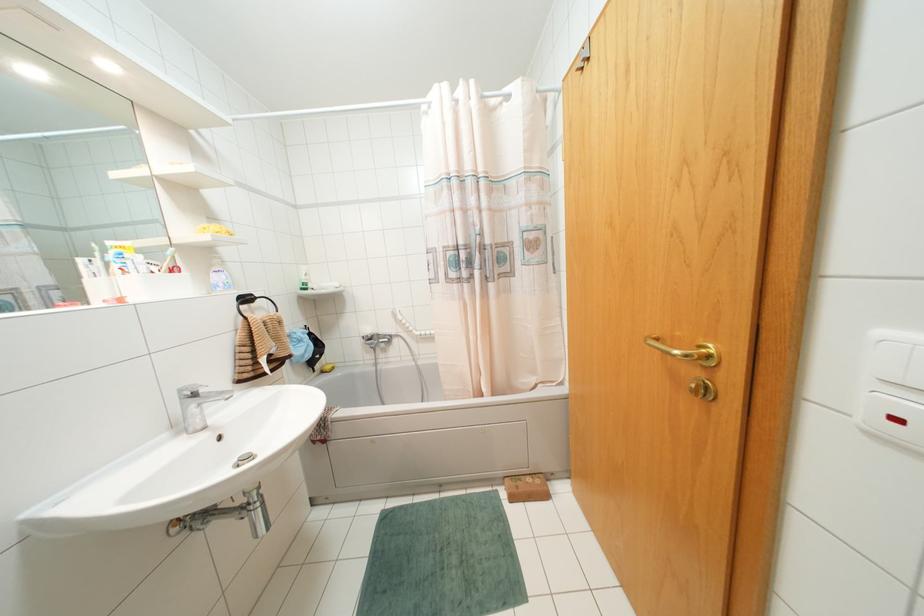
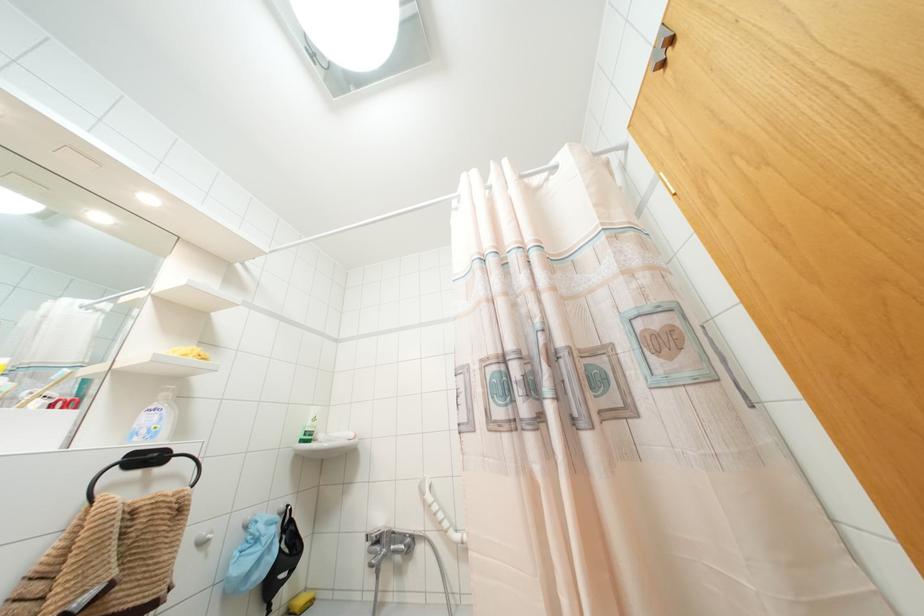
Where in the second image is the point corresponding to [305,274] from the first image?

(312, 419)